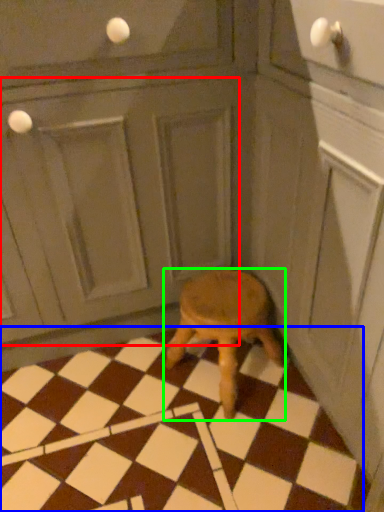
Question: Based on their relative distances, which object is farther from screen door (highlighted by a red box)? Choose from tile (highlighted by a blue box) and stool (highlighted by a green box).

Choices:
 (A) tile
 (B) stool

Answer: (A)